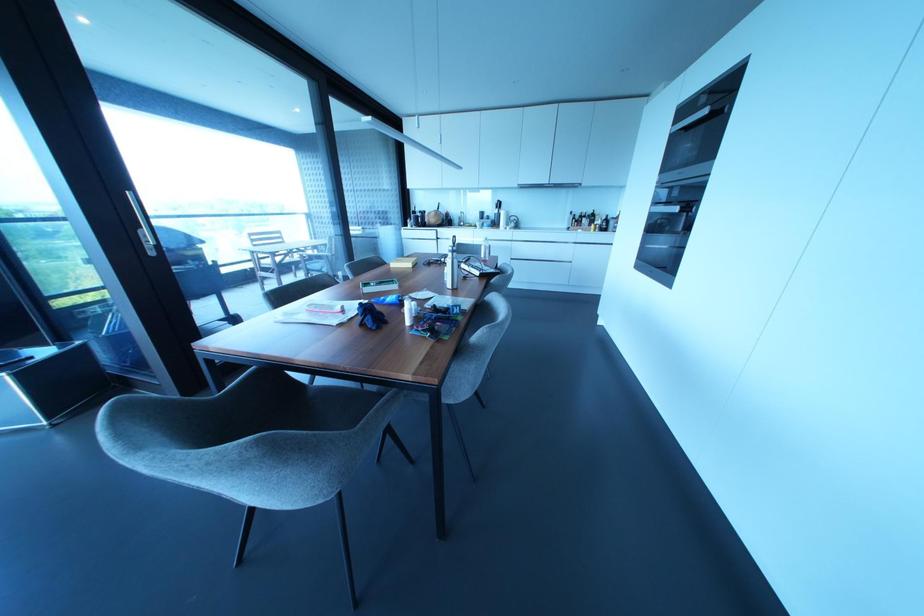
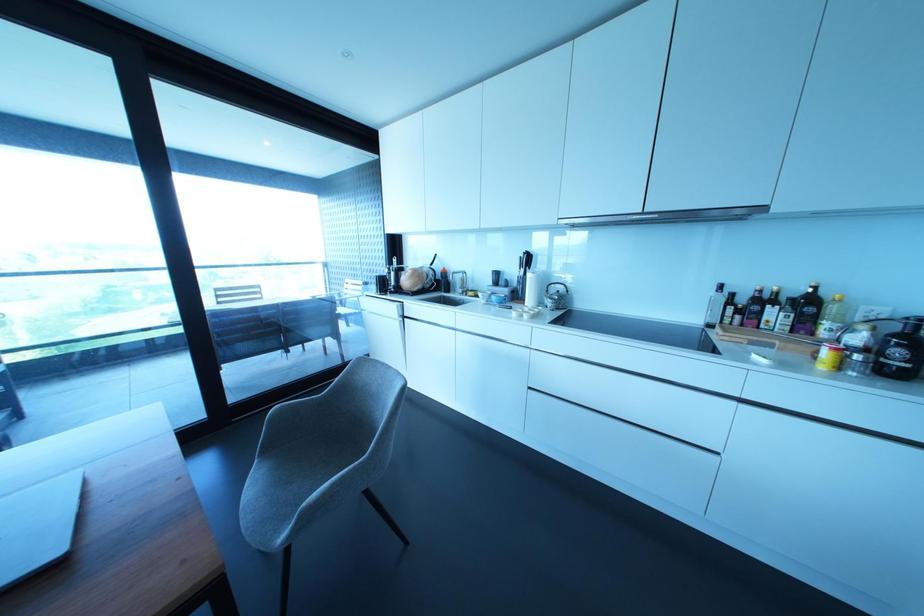
Where in the second image is the point corresponding to point 497,204 from the first image?

(527, 259)